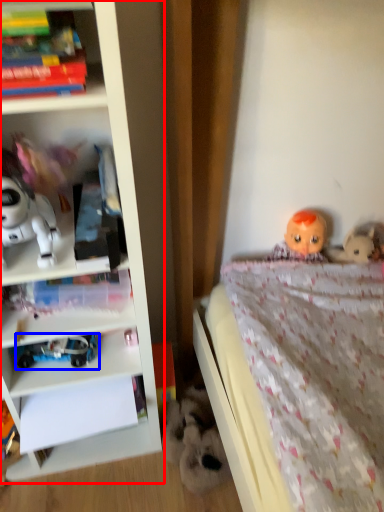
Question: Which of the following is the farthest to the observer, bookcase (highlighted by a red box) or toy (highlighted by a blue box)?

Choices:
 (A) bookcase
 (B) toy

Answer: (B)